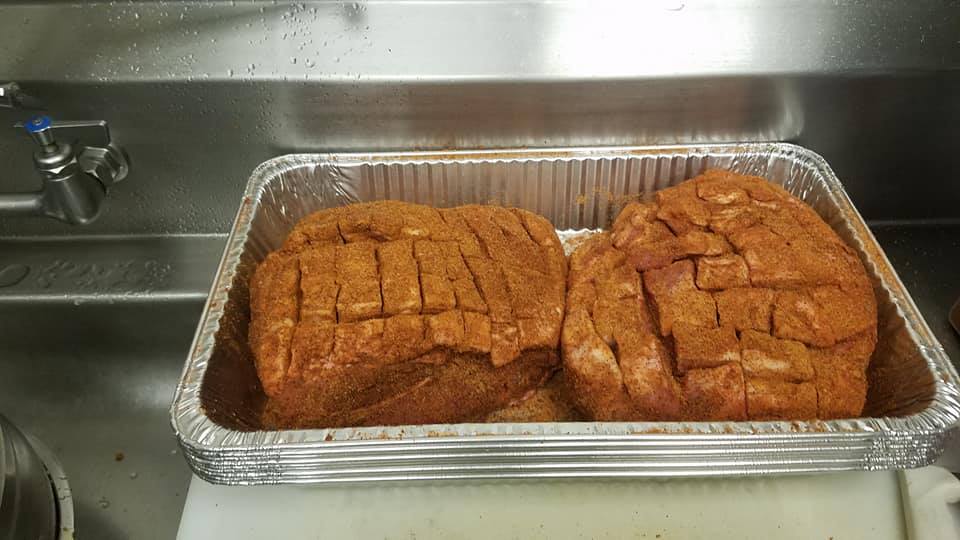
Find where the faucet tap attaches to the sink wall in the image. Your answer should be formatted as a list of tuples, i.e. [(x1, y1), (x2, y2), ...], where each tuple contains the x and y coordinates of a point satisfying the conditions above.

[(120, 158)]